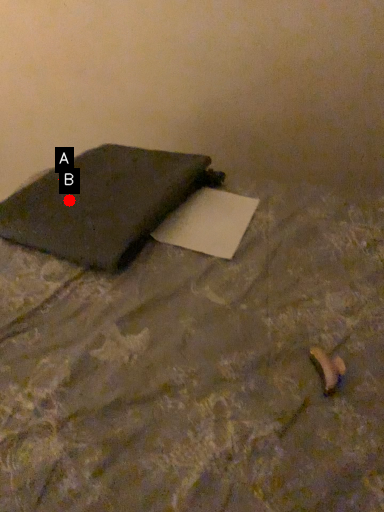
Question: Two points are circled on the image, labeled by A and B beside each circle. Which point is farther to the camera?

Choices:
 (A) A is further
 (B) B is further

Answer: (A)